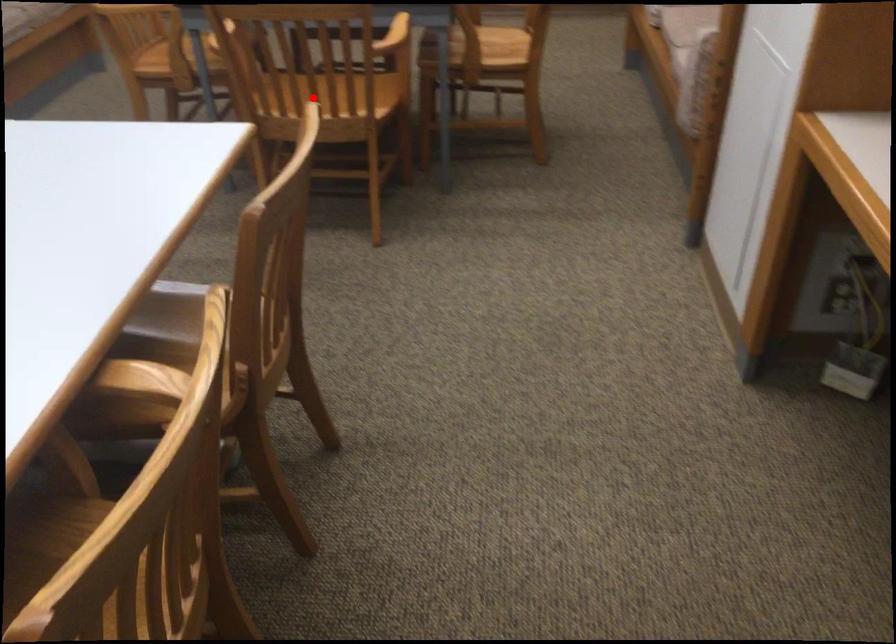
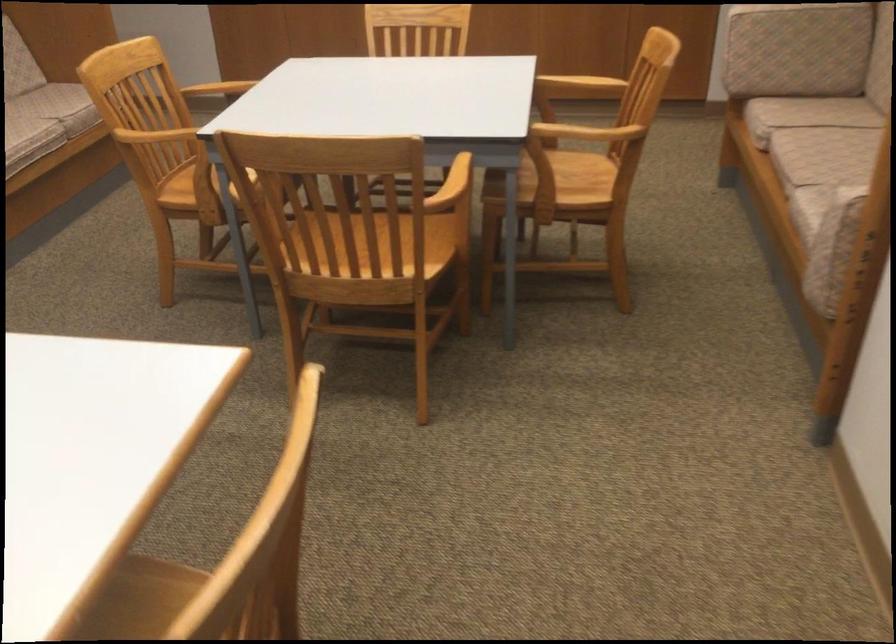
Where in the second image is the point corresponding to the highlighted location from the first image?

(358, 259)